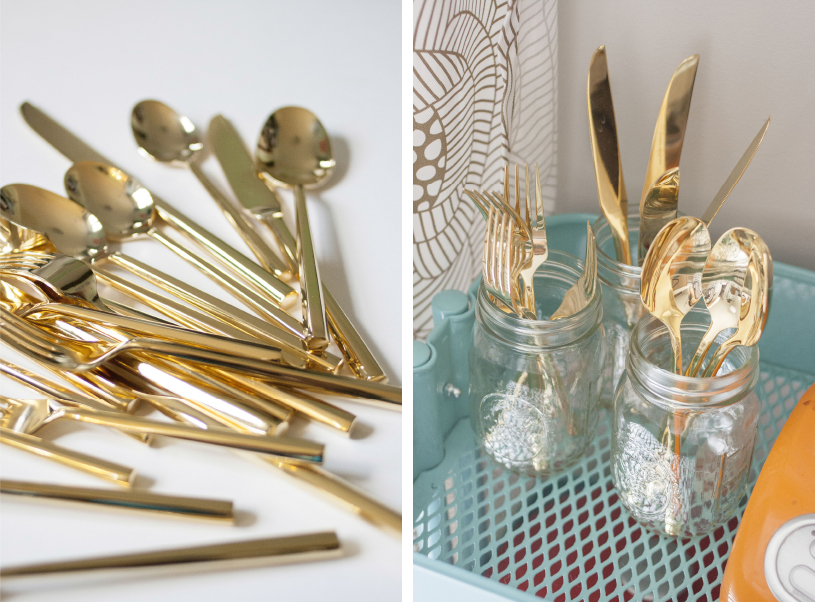
The height and width of the screenshot is (603, 815). Find the location of `spoon`. spoon is located at coordinates (302, 153), (153, 118), (115, 189), (55, 236), (659, 260), (737, 277), (759, 326).